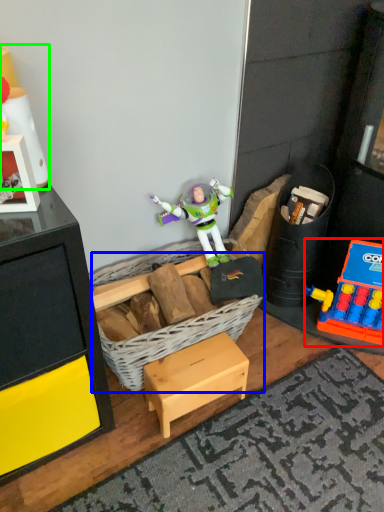
Question: Estimate the real-world distances between objects in this image. Which object is farther from toy (highlighted by a red box), basket (highlighted by a blue box) or toy (highlighted by a green box)?

Choices:
 (A) basket
 (B) toy

Answer: (B)